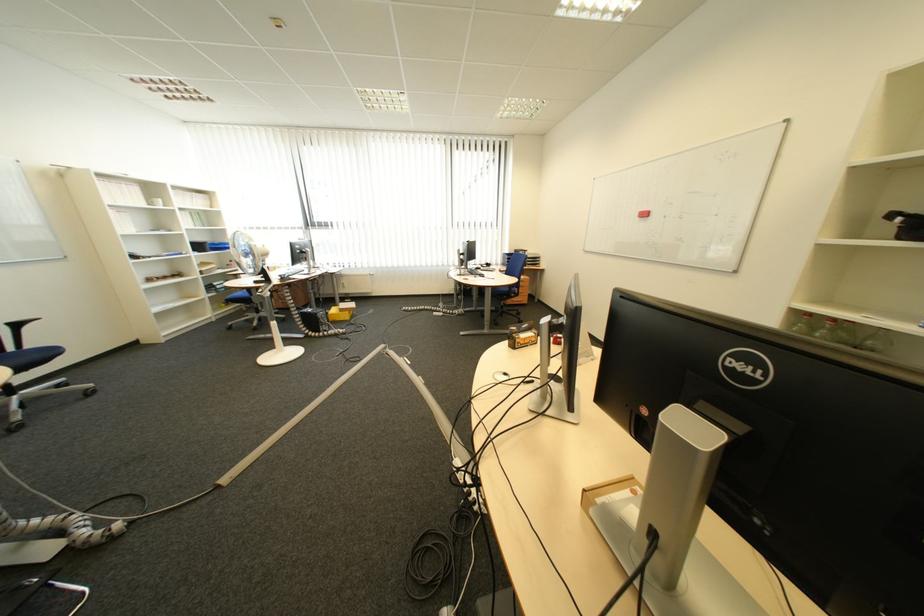
This screenshot has height=616, width=924. What do you see at coordinates (16, 419) in the screenshot?
I see `the black chair armrest` at bounding box center [16, 419].